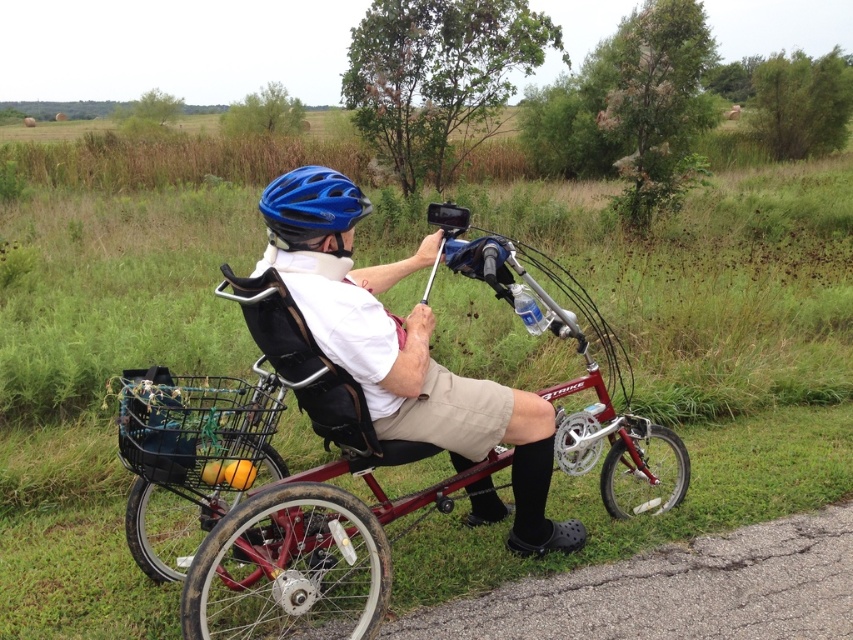
Can you confirm if metallic red tricycle at center is positioned to the left of black mesh basket at lower left?

In fact, metallic red tricycle at center is to the right of black mesh basket at lower left.

Is metallic red tricycle at center smaller than black mesh basket at lower left?

Actually, metallic red tricycle at center might be larger than black mesh basket at lower left.

What do you see at coordinates (310, 509) in the screenshot? I see `metallic red tricycle at center` at bounding box center [310, 509].

The width and height of the screenshot is (853, 640). In order to click on metallic red tricycle at center in this screenshot , I will do `click(310, 509)`.

The image size is (853, 640). What do you see at coordinates (310, 509) in the screenshot?
I see `metallic red tricycle at center` at bounding box center [310, 509].

Identify the location of metallic red tricycle at center. Image resolution: width=853 pixels, height=640 pixels. (310, 509).

Find the location of a particular element. The image size is (853, 640). metallic red tricycle at center is located at coordinates (310, 509).

Who is lower down, black mesh basket at lower left or blue matte helmet at upper center?

Positioned lower is black mesh basket at lower left.

Is point (155, 438) positioned behind point (271, 196)?

No.

Which is behind, point (223, 468) or point (299, 209)?

Point (223, 468)

Identify the location of black mesh basket at lower left. (190, 426).